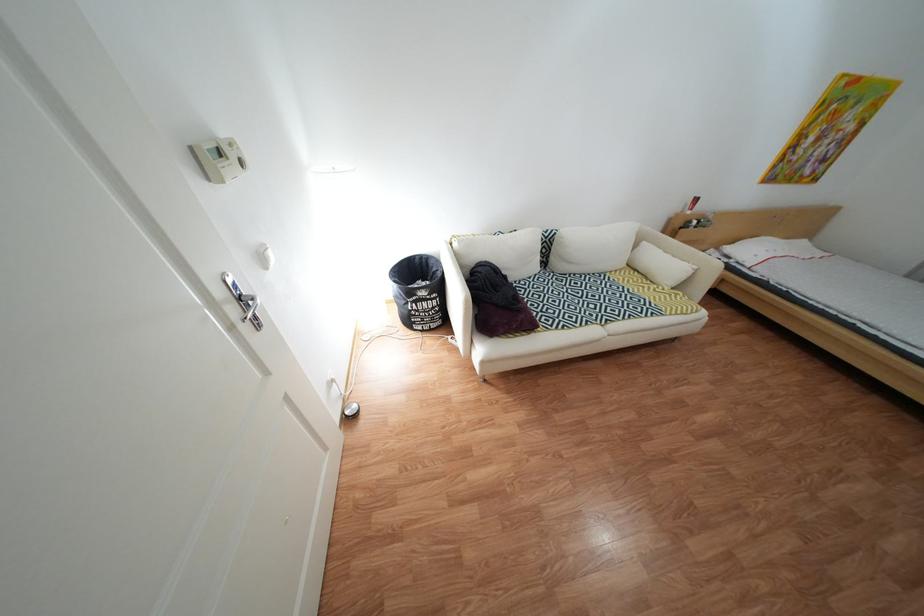
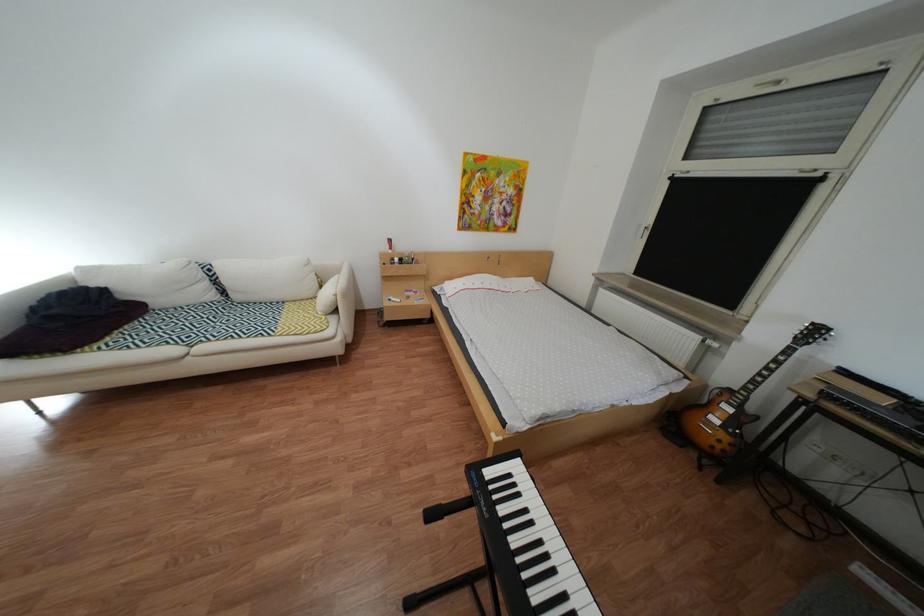
Find the pixel in the second image that matches pixel 527 277 in the first image.

(172, 304)